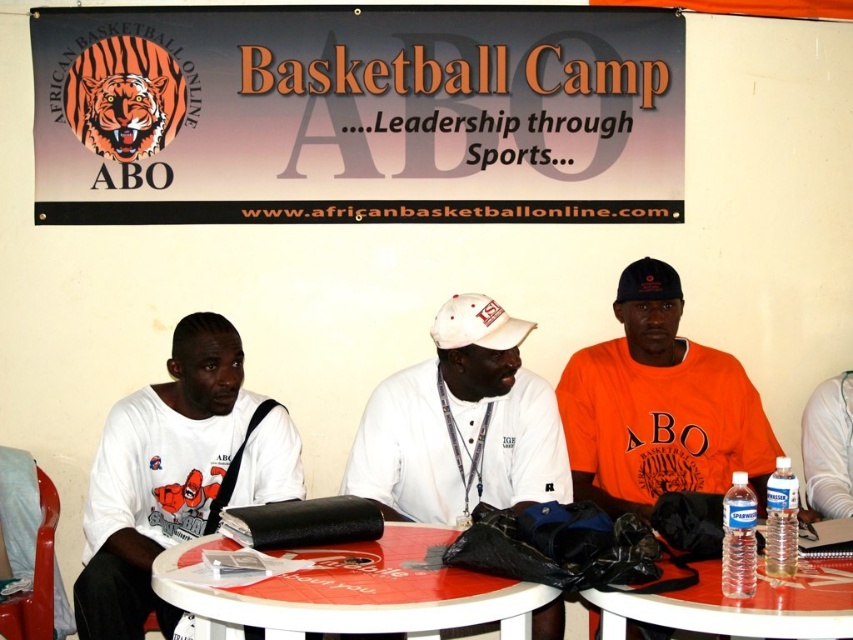
The height and width of the screenshot is (640, 853). What do you see at coordinates (659, 416) in the screenshot?
I see `orange matte t-shirt at center` at bounding box center [659, 416].

Who is taller, orange matte t-shirt at center or black fabric baseball cap at center?

orange matte t-shirt at center

Does point (631, 465) lie in front of point (654, 268)?

Yes, it is.

The height and width of the screenshot is (640, 853). I want to click on orange matte t-shirt at center, so click(659, 416).

Does white matte t-shirt at left have a lesser height compared to black fabric baseball cap at center?

In fact, white matte t-shirt at left may be taller than black fabric baseball cap at center.

Locate an element on the screen. white matte t-shirt at left is located at coordinates (177, 474).

Is point (129, 476) closer to camera compared to point (650, 262)?

Yes.

Locate an element on the screen. white matte t-shirt at left is located at coordinates (177, 474).

Who is positioned more to the left, white matte cap at center or orange matte t-shirt at center?

white matte cap at center

Which is below, white matte cap at center or orange matte t-shirt at center?

Positioned lower is orange matte t-shirt at center.

At what (x,y) coordinates should I click in order to perform the action: click on white matte cap at center. Please return your answer as a coordinate pair (x, y). Looking at the image, I should click on (461, 426).